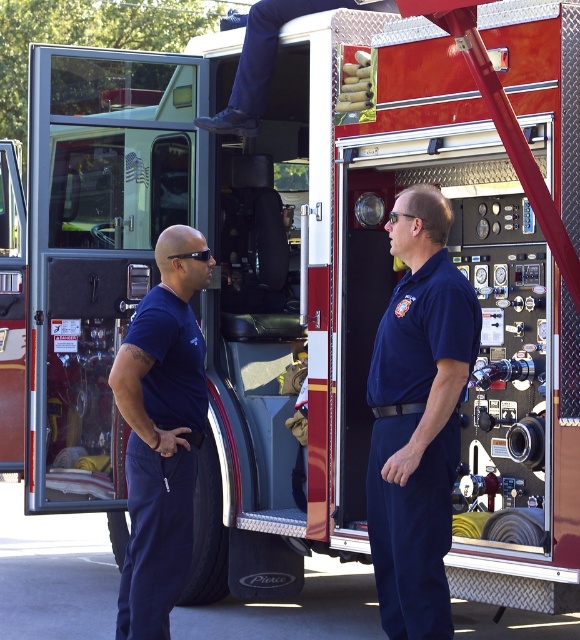
Question: Which point appears farthest from the camera in this image?

Choices:
 (A) (177, 524)
 (B) (372, 554)

Answer: (A)

Question: Which point is farther to the camera?

Choices:
 (A) navy blue uniform at center
 (B) dark blue uniform at center

Answer: (B)

Question: Is navy blue uniform at center to the left of dark blue uniform at center from the viewer's perspective?

Choices:
 (A) no
 (B) yes

Answer: (A)

Question: Is the position of navy blue uniform at center less distant than that of dark blue uniform at center?

Choices:
 (A) yes
 (B) no

Answer: (A)

Question: Does navy blue uniform at center have a smaller size compared to dark blue uniform at center?

Choices:
 (A) no
 (B) yes

Answer: (A)

Question: Among these objects, which one is farthest from the camera?

Choices:
 (A) navy blue uniform at center
 (B) dark blue uniform at center

Answer: (B)